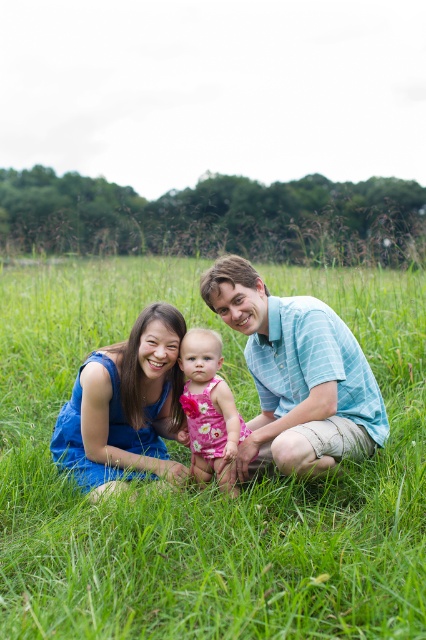
You are a photographer trying to capture a closeup of the blue striped shirt at center and the blue fabric dress at center. Which one should you zoom in on to ensure it fills the frame better?

The blue striped shirt at center is larger in size than the blue fabric dress at center, so zooming in on the blue striped shirt at center will fill the frame better.

You are a photographer trying to capture a family portrait. You have a camera with a lens that can focus on objects within a 20 inch range. You see the blue striped shirt at center and the blue fabric dress at center. Can you fit both into your camera frame without moving the camera?

The blue striped shirt at center and blue fabric dress at center are 24.15 inches apart, which exceeds the camera lens range of 20 inches. Therefore, you cannot fit both into the frame without moving the camera.